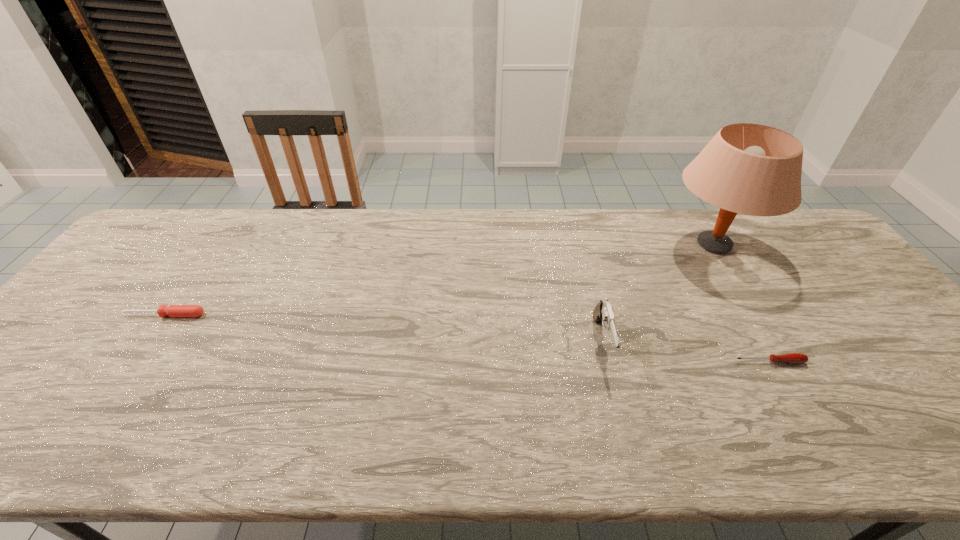
This screenshot has height=540, width=960. I want to click on lampshade, so click(751, 169).

At what (x,y) coordinates should I click in order to perform the action: click on the farthest object. Please return your answer as a coordinate pair (x, y). The width and height of the screenshot is (960, 540). Looking at the image, I should click on (751, 169).

Identify the location of the third shortest object. This screenshot has height=540, width=960. (603, 313).

The image size is (960, 540). I want to click on gun, so click(x=603, y=313).

I want to click on the farther screwdriver, so click(x=173, y=310).

At what (x,y) coordinates should I click in order to perform the action: click on the leftmost object. Please return your answer as a coordinate pair (x, y). This screenshot has height=540, width=960. Looking at the image, I should click on (173, 310).

You are a GUI agent. You are given a task and a screenshot of the screen. Output one action in this format:
    pyautogui.click(x=<x>, y=<y>)
    Task: Click on the nearer screwdriver
    The height and width of the screenshot is (540, 960).
    Given the screenshot: What is the action you would take?
    pyautogui.click(x=795, y=358)

Where is `vacant space located 0.250m on the front-facing side of the lampshade`? vacant space located 0.250m on the front-facing side of the lampshade is located at coordinates (585, 245).

Find the location of a particular element. Image resolution: width=960 pixels, height=540 pixels. vacant point located on the front-facing side of the lampshade is located at coordinates (565, 245).

Locate an element on the screen. The width and height of the screenshot is (960, 540). free spot located on the front-facing side of the lampshade is located at coordinates (588, 245).